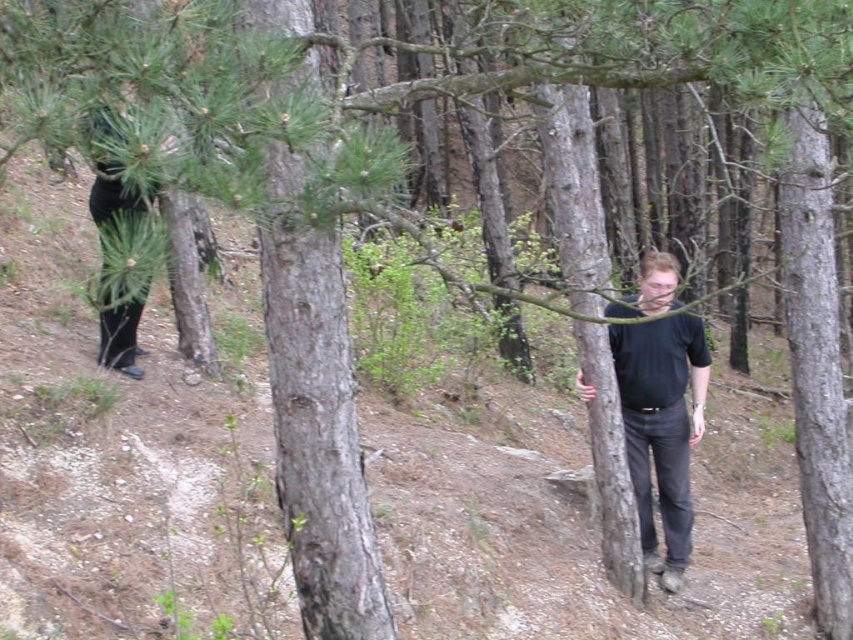
Question: Does black matte shirt at center have a larger size compared to black matte pants at left?

Choices:
 (A) no
 (B) yes

Answer: (B)

Question: Is black matte shirt at center bigger than black matte pants at left?

Choices:
 (A) yes
 (B) no

Answer: (A)

Question: Which point is closer to the camera?

Choices:
 (A) (109, 186)
 (B) (689, 337)

Answer: (A)

Question: Which point is farther to the camera?

Choices:
 (A) black matte shirt at center
 (B) black matte pants at left

Answer: (B)

Question: Does black matte shirt at center appear over black matte pants at left?

Choices:
 (A) yes
 (B) no

Answer: (B)